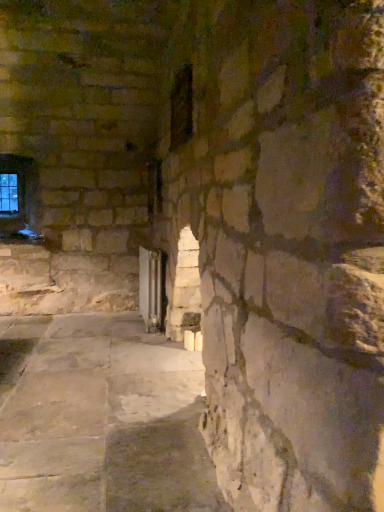
Question: Does dark glass window at center, placed as the 1th window when sorted from front to back, turn towards transparent glass door at center?

Choices:
 (A) no
 (B) yes

Answer: (A)

Question: From the image's perspective, does dark glass window at center, placed as the 1th window when sorted from front to back, appear higher than transparent glass door at center?

Choices:
 (A) no
 (B) yes

Answer: (B)

Question: Is dark glass window at center, placed as the 1th window when sorted from front to back, next to transparent glass door at center?

Choices:
 (A) yes
 (B) no

Answer: (B)

Question: Can you confirm if dark glass window at center, marked as the 1th window in a right-to-left arrangement, is positioned to the left of transparent glass door at center?

Choices:
 (A) no
 (B) yes

Answer: (A)

Question: Can you confirm if dark glass window at center, marked as the 2th window in a left-to-right arrangement, is smaller than transparent glass door at center?

Choices:
 (A) no
 (B) yes

Answer: (B)

Question: Is transparent glass door at center wider or thinner than dark glass window at center, the second window positioned from the back?

Choices:
 (A) wide
 (B) thin

Answer: (A)

Question: Considering their positions, is transparent glass door at center located in front of or behind dark glass window at center, marked as the 1th window in a right-to-left arrangement?

Choices:
 (A) behind
 (B) front

Answer: (A)

Question: In terms of height, does transparent glass door at center look taller or shorter compared to dark glass window at center, the second window positioned from the back?

Choices:
 (A) short
 (B) tall

Answer: (B)

Question: Choose the correct answer: Is transparent glass door at center inside dark glass window at center, marked as the 1th window in a right-to-left arrangement, or outside it?

Choices:
 (A) outside
 (B) inside

Answer: (A)

Question: Looking at the image, does dark glass window at center, marked as the 2th window in a left-to-right arrangement, seem bigger or smaller compared to transparent glass door at center?

Choices:
 (A) small
 (B) big

Answer: (A)

Question: From a real-world perspective, is dark glass window at center, placed as the 1th window when sorted from front to back, above or below transparent glass door at center?

Choices:
 (A) below
 (B) above

Answer: (B)

Question: Considering the positions of dark glass window at center, marked as the 2th window in a left-to-right arrangement, and transparent glass door at center in the image, is dark glass window at center, marked as the 2th window in a left-to-right arrangement, taller or shorter than transparent glass door at center?

Choices:
 (A) short
 (B) tall

Answer: (A)

Question: Looking at their shapes, would you say dark glass window at center, the second window positioned from the back, is wider or thinner than transparent glass door at center?

Choices:
 (A) thin
 (B) wide

Answer: (A)

Question: Is point (175, 142) closer or farther from the camera than point (18, 195)?

Choices:
 (A) farther
 (B) closer

Answer: (B)

Question: From a real-world perspective, is dark glass window at center, placed as the 1th window when sorted from front to back, above or below clear glass window at upper left, the 2th window when ordered from right to left?

Choices:
 (A) above
 (B) below

Answer: (A)